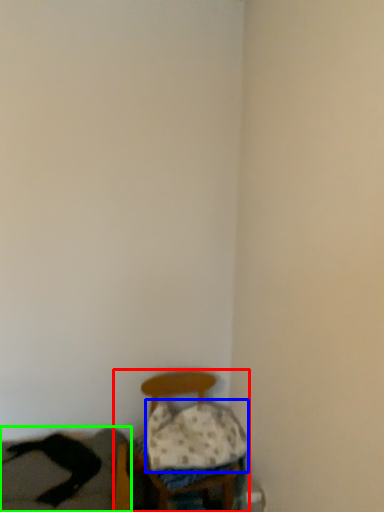
Question: Which object is the farthest from furniture (highlighted by a red box)? Choose among these: pillow (highlighted by a blue box) or couch (highlighted by a green box).

Choices:
 (A) pillow
 (B) couch

Answer: (B)